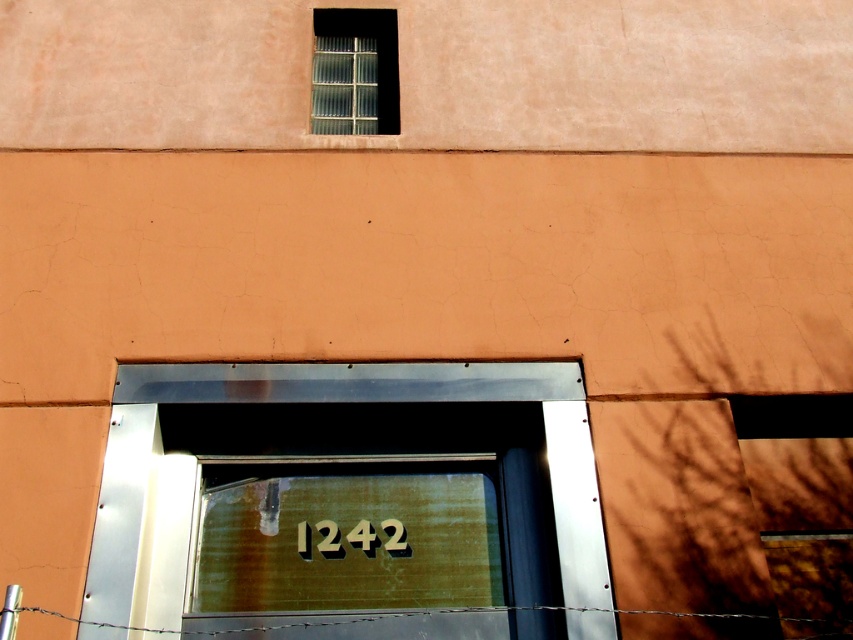
You are a delivery person trying to reach apartment number 1242. You see the clear glass window at upper center and the wooden sign at center. Which object should you look at to find the apartment number?

The apartment number 1242 is visible on the clear glass window at upper center, so you should look at the clear glass window at upper center.

You are a delivery person trying to locate apartment number 1242. You see a wooden sign at center and barbed wire at bottom. Which object is narrower?

The wooden sign at center is thinner than barbed wire at bottom, so the wooden sign at center is narrower.

You are a delivery person trying to locate apartment number 1242. The building has a wooden sign at center and barbed wire at bottom. Which object would you look at to find the apartment number?

The wooden sign at center is much taller than the barbed wire at bottom, so the apartment number 1242 is likely displayed on the wooden sign at center.